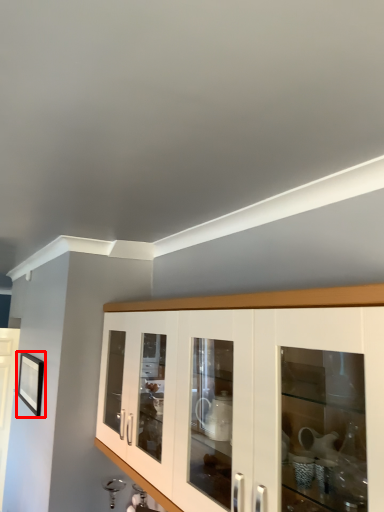
Question: From the image, what is the correct spatial relationship of picture frame (annotated by the red box) in relation to cabinetry?

Choices:
 (A) right
 (B) left

Answer: (B)